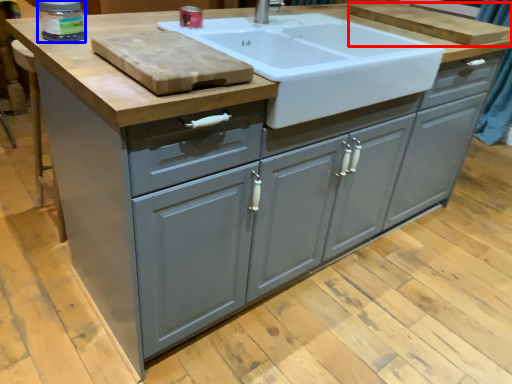
Question: Which point is further to the camera, cutting board (highlighted by a red box) or appliance (highlighted by a blue box)?

Choices:
 (A) cutting board
 (B) appliance

Answer: (A)